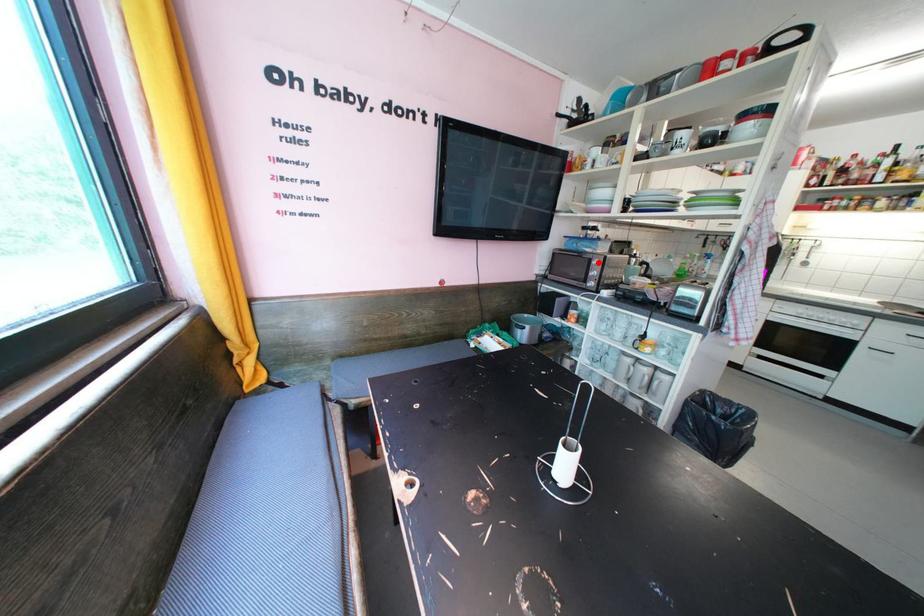
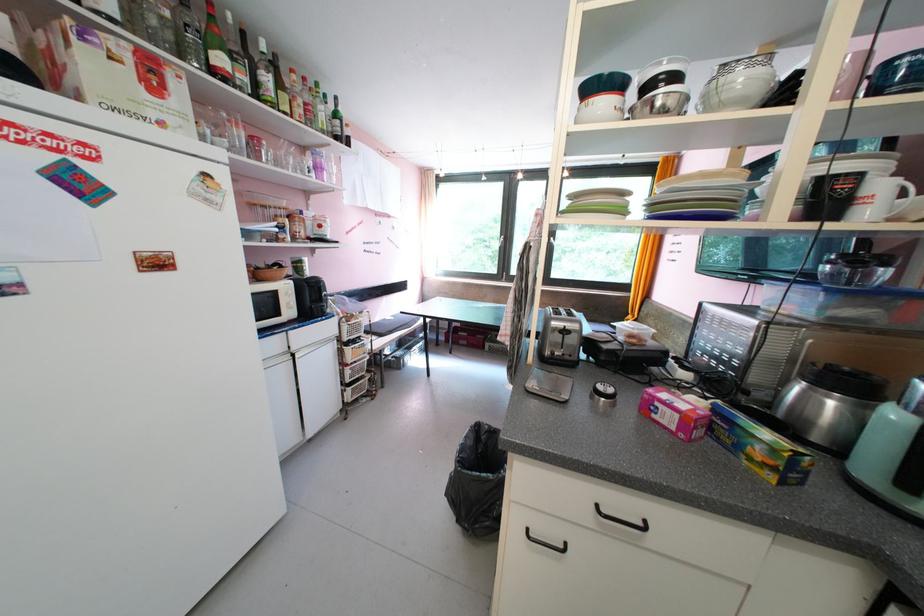
Question: I am providing you with two images of the same scene from different viewpoints. A red point is marked on the first image. Can you still see the location of the red point in image 2?

Choices:
 (A) Yes
 (B) No

Answer: (B)